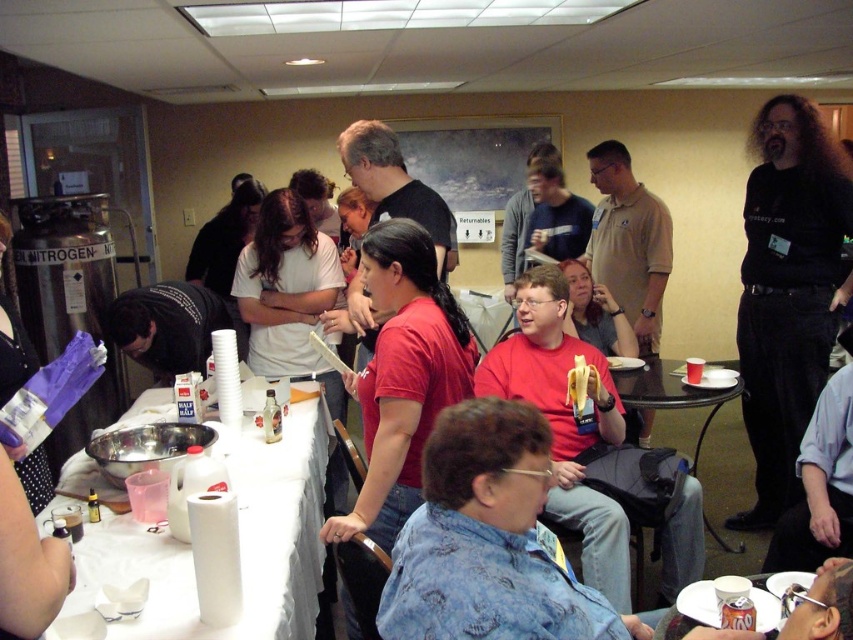
Question: Is black matte shirt at upper right wider than black plastic table at center?

Choices:
 (A) yes
 (B) no

Answer: (B)

Question: In this image, where is black matte shirt at upper right located relative to black plastic table at center?

Choices:
 (A) left
 (B) right

Answer: (B)

Question: Is white paper towel at lower left to the right of black plastic table at center from the viewer's perspective?

Choices:
 (A) no
 (B) yes

Answer: (A)

Question: Which point is closer to the camera taking this photo?

Choices:
 (A) click(x=787, y=416)
 (B) click(x=204, y=339)
 (C) click(x=254, y=636)

Answer: (C)

Question: Considering the real-world distances, which object is closest to the black matte shirt at upper right?

Choices:
 (A) black matte shirt at left
 (B) white paper towel at lower left

Answer: (B)

Question: Which point is farther to the camera?

Choices:
 (A) black matte shirt at left
 (B) black plastic table at center
 (C) white paper towel at lower left

Answer: (A)